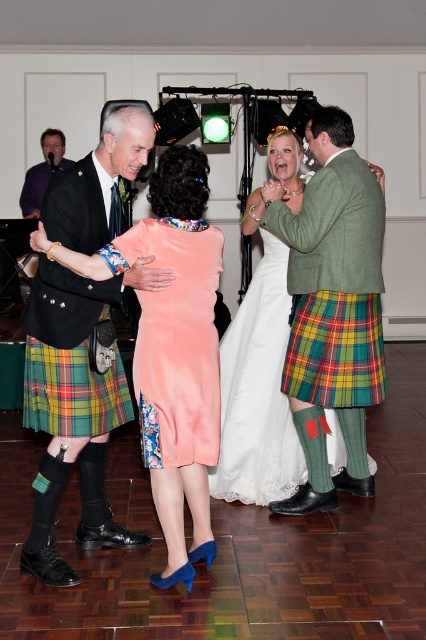
You are a photographer at the wedding reception and need to capture a group photo of the two women in traditional Scottish attire. The peach velvet dress at center and the white satin dress at center are both in the frame. Which dress will require more space to avoid being cropped out?

The white satin dress at center is wider than the peach velvet dress at center, so it will require more space to avoid being cropped out.

You are a photographer holding a camera and standing near the edge of the dance floor. You want to take a photo of the peach velvet dress at center. Can you get a clear shot without moving closer than 3 meters?

The distance between the peach velvet dress at center and the camera is 2.99 meters, which is just under 3 meters. Therefore, you can take a clear photo without needing to move closer than 3 meters.

You are a photographer at the wedding reception. You need to position yourself so that both the peach velvet dress at center and the plaid fabric kilt at center are in frame. Given their height difference, which one might require you to adjust your camera angle upwards to capture fully?

The peach velvet dress at center is taller than the plaid fabric kilt at center, so you would need to adjust your camera angle upwards to capture the peach velvet dress at center fully.